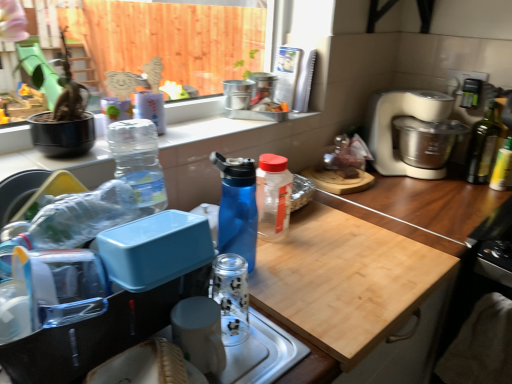
Question: Is point (260, 216) positioned closer to the camera than point (408, 170)?

Choices:
 (A) farther
 (B) closer

Answer: (B)

Question: In terms of height, does transparent plastic bottle at center, the third bottle positioned from the right, look taller or shorter compared to beige plastic food processor at right?

Choices:
 (A) tall
 (B) short

Answer: (B)

Question: Which object is positioned farthest from the transparent plastic containers at lower left?

Choices:
 (A) green glass bottle at right, the 4th bottle viewed from the front
 (B) beige plastic food processor at right
 (C) transparent glass jar at sink, which appears as the second appliance when viewed from the back
 (D) blue glossy water bottle at center, acting as the 4th bottle starting from the back
 (E) transparent plastic bottle at center, which is the third bottle in front-to-back order

Answer: (A)

Question: Which object is the closest to the translucent plastic bag at upper right?

Choices:
 (A) blue glossy water bottle at center, acting as the 4th bottle starting from the back
 (B) wooden cutting board at center
 (C) transparent glass jar at sink, acting as the 1th appliance starting from the front
 (D) transparent glass bottle at lower center, the 2th bottle viewed from the left
 (E) metallic silver canisters at upper center, the first appliance from the right

Answer: (E)